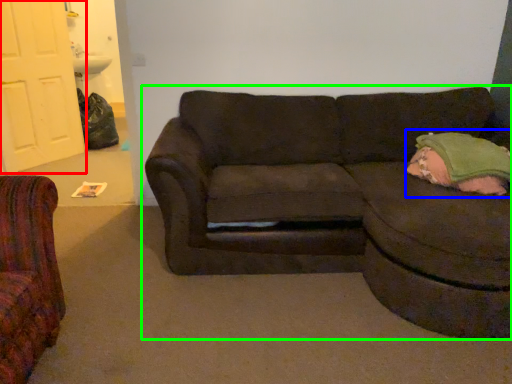
Question: Which object is positioned closest to door (highlighted by a red box)? Select from pillow (highlighted by a blue box) and studio couch (highlighted by a green box).

Choices:
 (A) pillow
 (B) studio couch

Answer: (B)